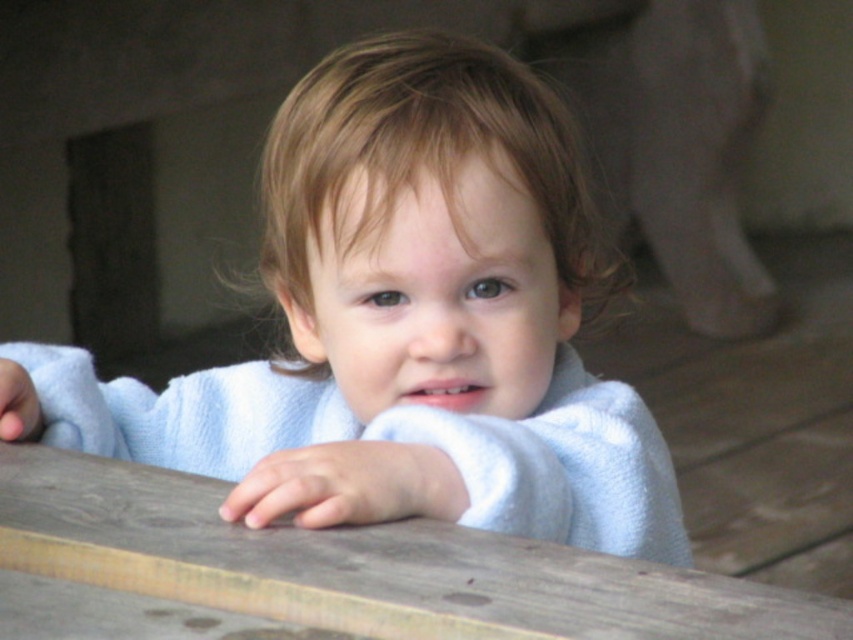
Question: Is white soft towel at center wider than wooden table at center?

Choices:
 (A) no
 (B) yes

Answer: (B)

Question: Is white soft towel at center to the right of wooden table at center from the viewer's perspective?

Choices:
 (A) yes
 (B) no

Answer: (A)

Question: Which is farther from the wooden table at center?

Choices:
 (A) white fluffy robe at center
 (B) white soft towel at center

Answer: (B)

Question: Which point is closer to the camera taking this photo?

Choices:
 (A) (99, 442)
 (B) (656, 550)
 (C) (675, 628)

Answer: (C)

Question: Does white soft towel at center have a larger size compared to white fluffy robe at center?

Choices:
 (A) yes
 (B) no

Answer: (A)

Question: Which object appears closest to the camera in this image?

Choices:
 (A) white soft towel at center
 (B) white fluffy robe at center
 (C) wooden table at center

Answer: (C)